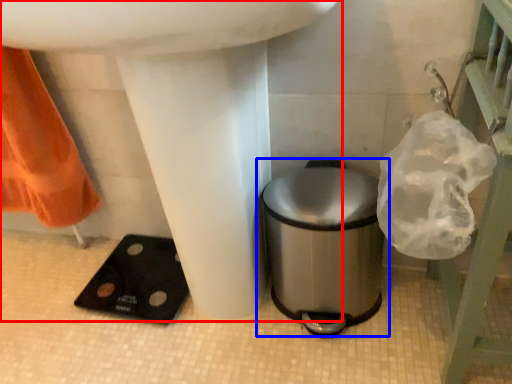
Question: Which of the following is the closest to the observer, sink (highlighted by a red box) or waste container (highlighted by a blue box)?

Choices:
 (A) sink
 (B) waste container

Answer: (A)